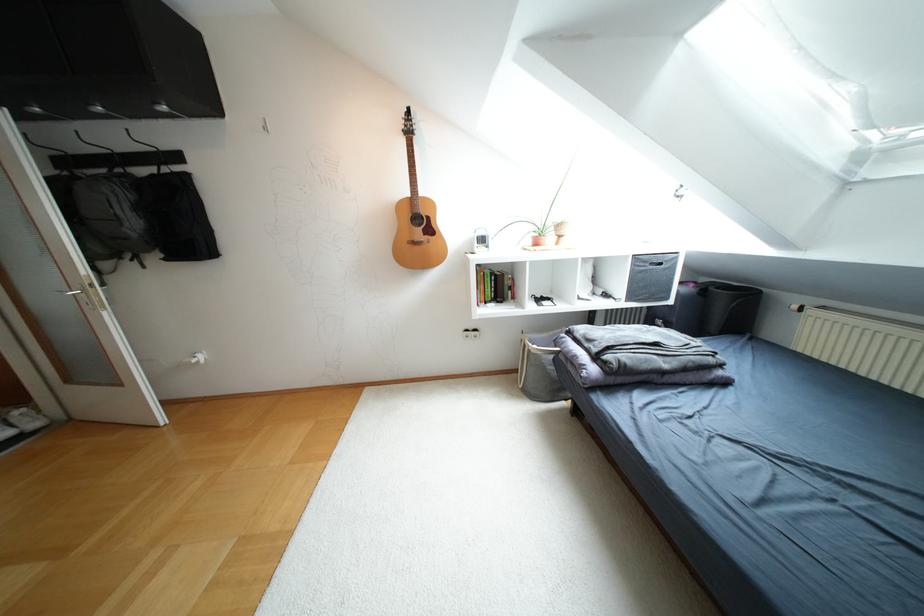
I want to click on acoustic guitar, so click(416, 217).